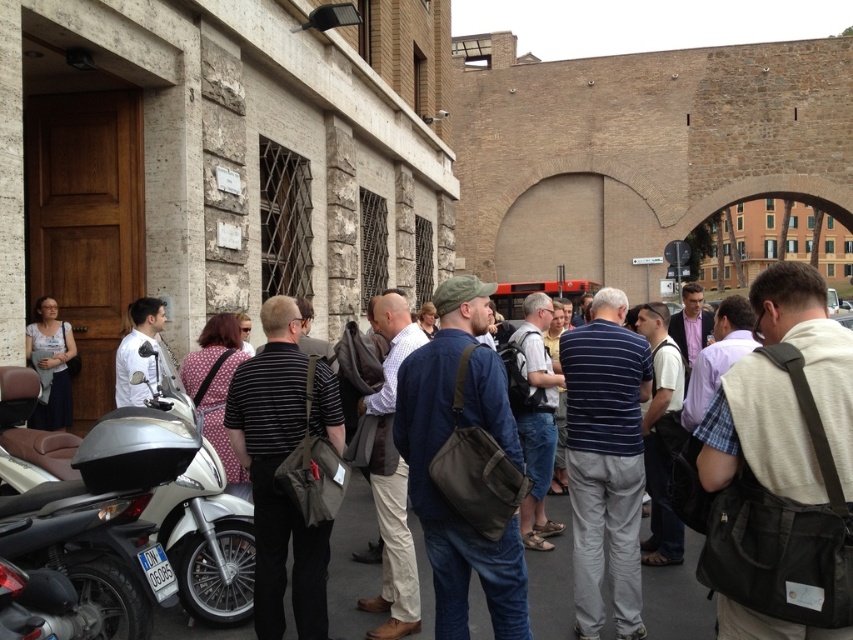
Which of these two, silver metallic scooter at lower left or dark blue jeans at center, stands shorter?

Standing shorter between the two is silver metallic scooter at lower left.

Is point (180, 547) less distant than point (241, 637)?

That is False.

The image size is (853, 640). What do you see at coordinates (199, 513) in the screenshot?
I see `silver metallic scooter at lower left` at bounding box center [199, 513].

Identify the location of silver metallic scooter at lower left. (199, 513).